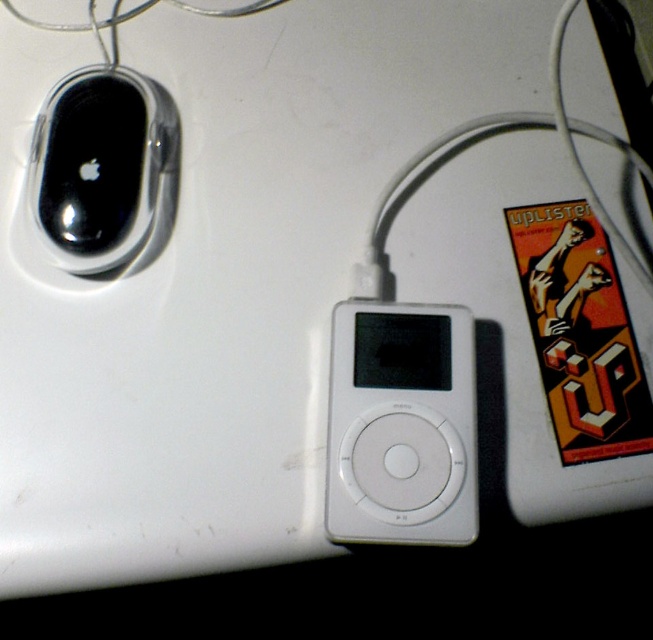
Which of these two, white matte/ipod at center or sleek black mouse at upper left, stands shorter?

white matte/ipod at center is shorter.

What do you see at coordinates (402, 424) in the screenshot? I see `white matte/ipod at center` at bounding box center [402, 424].

What are the coordinates of `white matte/ipod at center` in the screenshot? It's located at (402, 424).